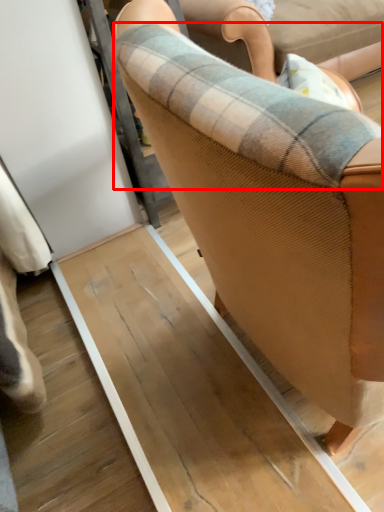
Question: Considering the relative positions of plaid (annotated by the red box) and chair in the image provided, where is plaid (annotated by the red box) located with respect to the staircase?

Choices:
 (A) left
 (B) right

Answer: (B)